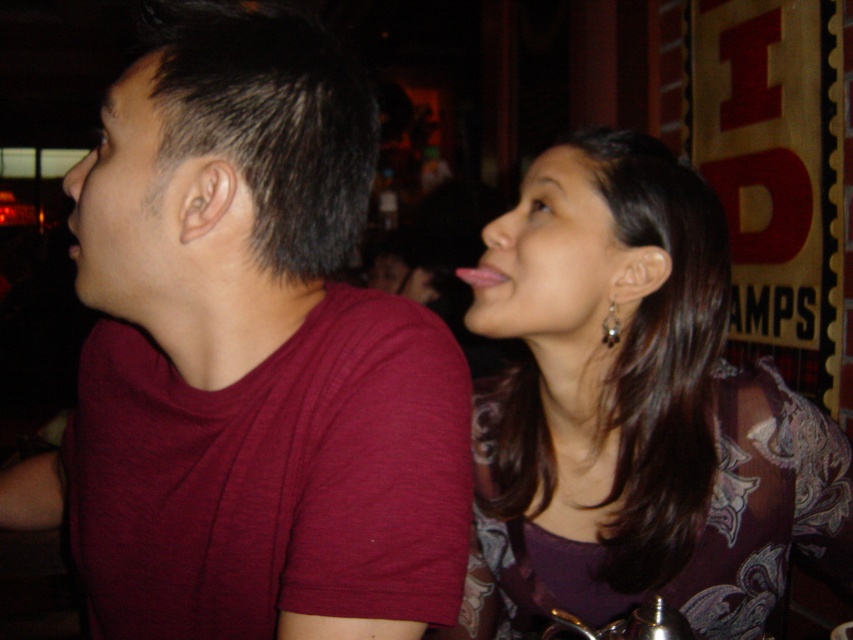
Is matte purple blouse at upper right behind silver metallic earring at upper right?

No, it is in front of silver metallic earring at upper right.

Which is in front, point (509, 445) or point (602, 330)?

Point (602, 330) is in front.

Identify the location of matte purple blouse at upper right. Image resolution: width=853 pixels, height=640 pixels. (633, 410).

The image size is (853, 640). In order to click on matte purple blouse at upper right in this screenshot , I will do `click(633, 410)`.

Is point (347, 554) positioned in front of point (611, 337)?

That is True.

Is point (79, 378) farther from camera compared to point (607, 326)?

That is False.

Which is behind, point (155, 458) or point (611, 316)?

Point (611, 316)

Where is `maroon t-shirt at left`? This screenshot has width=853, height=640. maroon t-shirt at left is located at coordinates (252, 355).

Which of these two, maroon t-shirt at left or matte purple blouse at upper right, stands shorter?

matte purple blouse at upper right is shorter.

Who is more distant from viewer, (347,480) or (607,500)?

The point (607,500) is behind.

Who is more forward, (247, 452) or (590, 284)?

Point (247, 452)

This screenshot has height=640, width=853. Find the location of `maroon t-shirt at left`. maroon t-shirt at left is located at coordinates (252, 355).